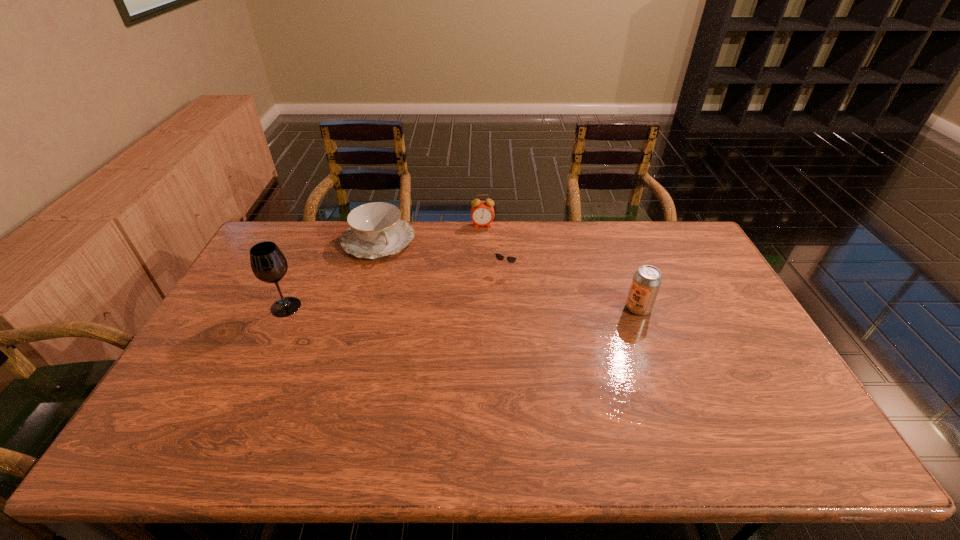
Locate an element on the screen. Image resolution: width=960 pixels, height=540 pixels. chinaware that is at the far edge is located at coordinates pos(375,230).

You are a GUI agent. You are given a task and a screenshot of the screen. Output one action in this format:
    pyautogui.click(x=<x>, y=<y>)
    Task: Click on the object present at the left edge
    This screenshot has height=540, width=960.
    Given the screenshot: What is the action you would take?
    pyautogui.click(x=268, y=263)

What are the coordinates of `free space at the far edge of the desktop` in the screenshot? It's located at (624, 231).

The width and height of the screenshot is (960, 540). What are the coordinates of `free space at the near edge` in the screenshot? It's located at (547, 414).

Find the location of a particular element. vacant space at the left edge of the desktop is located at coordinates (241, 334).

Find the location of `vacant space at the far left corner of the desktop`. vacant space at the far left corner of the desktop is located at coordinates (288, 230).

At what (x,y) coordinates should I click in order to perform the action: click on free spot at the near left corner of the desktop. Please return your answer as a coordinate pair (x, y). The image size is (960, 540). Looking at the image, I should click on (181, 400).

At what (x,y) coordinates should I click in order to perform the action: click on free space at the far right corner. Please return your answer as a coordinate pair (x, y). The image size is (960, 540). Looking at the image, I should click on (672, 257).

In order to click on free space between the sunglasses and the alarm clock in this screenshot , I will do `click(493, 247)`.

Find the location of a particular element. The height and width of the screenshot is (540, 960). free space that is in between the alarm clock and the beer can is located at coordinates (561, 267).